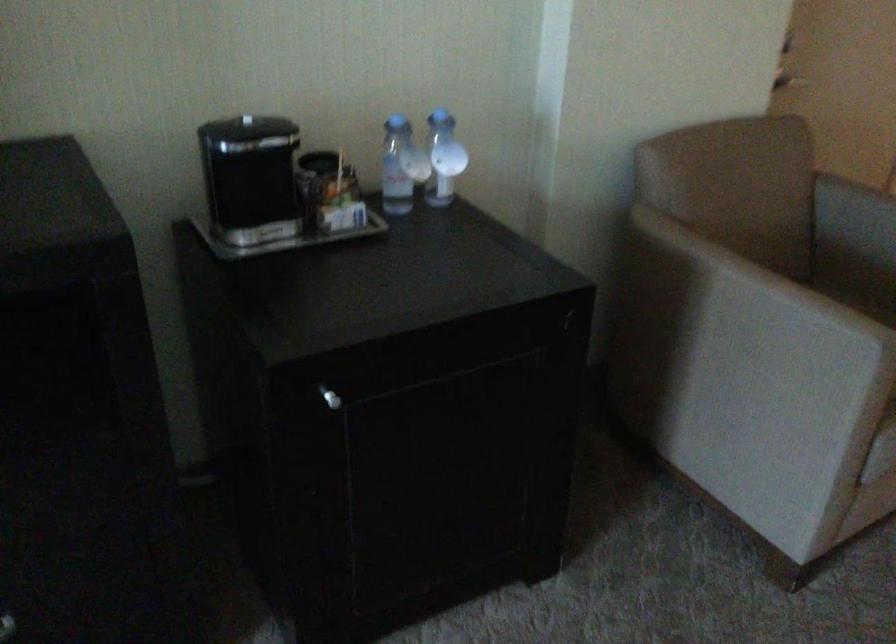
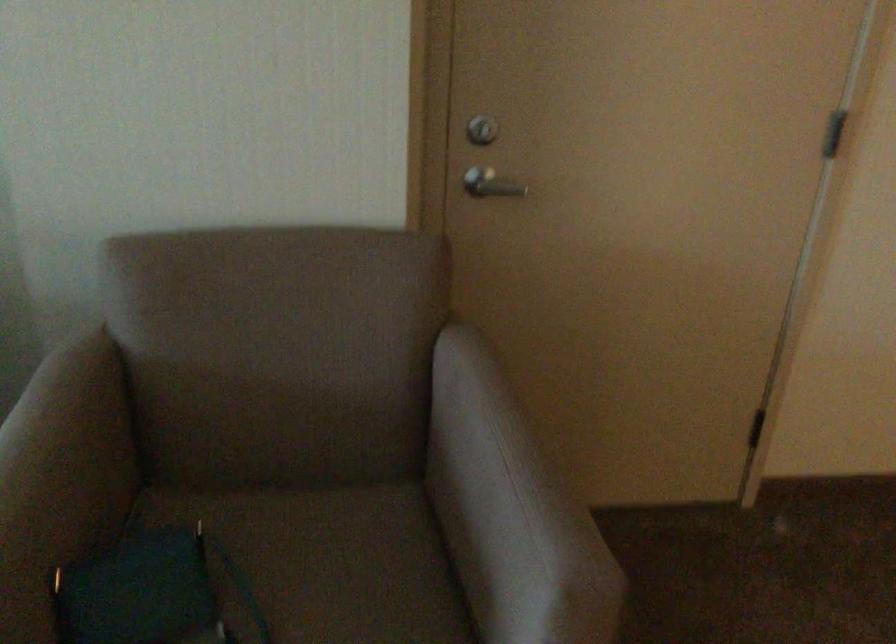
What movement of the cameraman would produce the second image?

The cameraman walked toward right, forward.